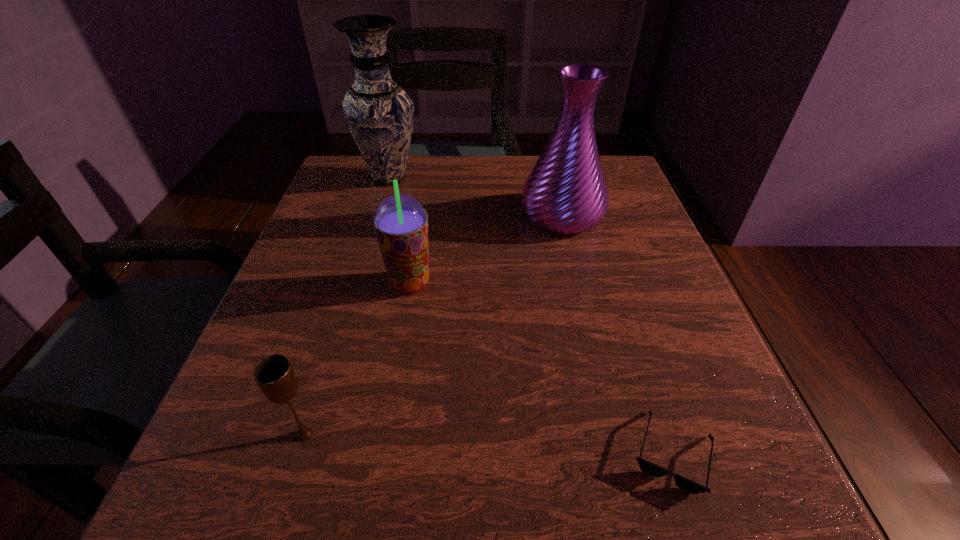
The height and width of the screenshot is (540, 960). In the image, there is a desktop. In order to click on vacant space at the left edge in this screenshot , I will do `click(311, 324)`.

Identify the location of vacant space at the right edge of the desktop. (677, 350).

The image size is (960, 540). I want to click on blank space at the near right corner of the desktop, so click(670, 483).

What are the coordinates of `free space between the third nearest object and the shortest object` in the screenshot? It's located at (541, 368).

You are a GUI agent. You are given a task and a screenshot of the screen. Output one action in this format:
    pyautogui.click(x=<x>, y=<y>)
    Task: Click on the free space between the third shortest object and the chalice
    The image size is (960, 540).
    Given the screenshot: What is the action you would take?
    pyautogui.click(x=358, y=359)

Find the location of a particular element. This screenshot has width=960, height=540. free space that is in between the left vase and the shortest object is located at coordinates (531, 315).

You are a GUI agent. You are given a task and a screenshot of the screen. Output one action in this format:
    pyautogui.click(x=<x>, y=<y>)
    Task: Click on the free space between the fourth tallest object and the right vase
    This screenshot has height=540, width=960.
    Given the screenshot: What is the action you would take?
    pyautogui.click(x=434, y=325)

You are a GUI agent. You are given a task and a screenshot of the screen. Output one action in this format:
    pyautogui.click(x=<x>, y=<y>)
    Task: Click on the free space between the shortest object and the right vase
    Image resolution: width=960 pixels, height=540 pixels.
    Given the screenshot: What is the action you would take?
    pyautogui.click(x=617, y=334)

Where is `free space between the third shortest object and the chalice`? The height and width of the screenshot is (540, 960). free space between the third shortest object and the chalice is located at coordinates (358, 359).

Find the location of a particular element. The height and width of the screenshot is (540, 960). free space between the shortest object and the right vase is located at coordinates (617, 334).